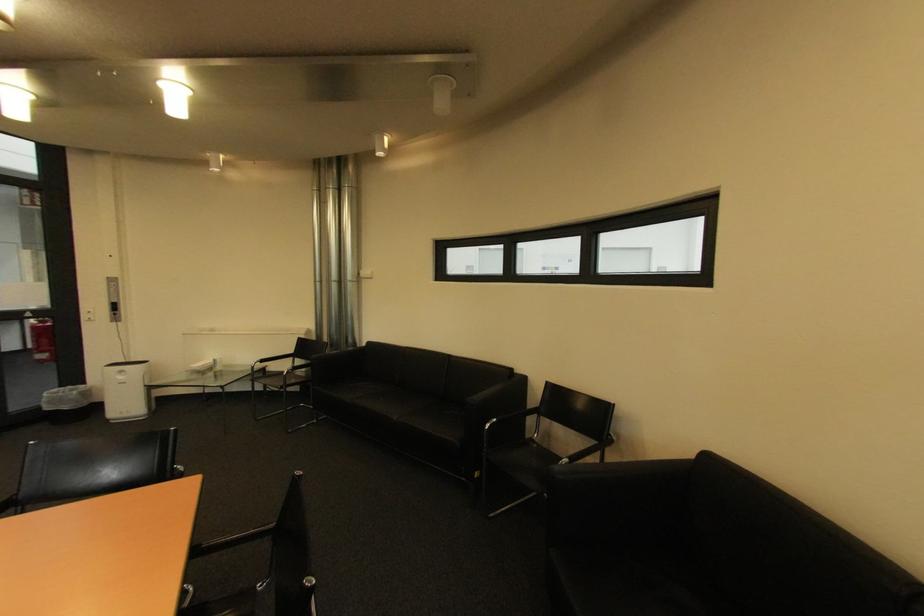
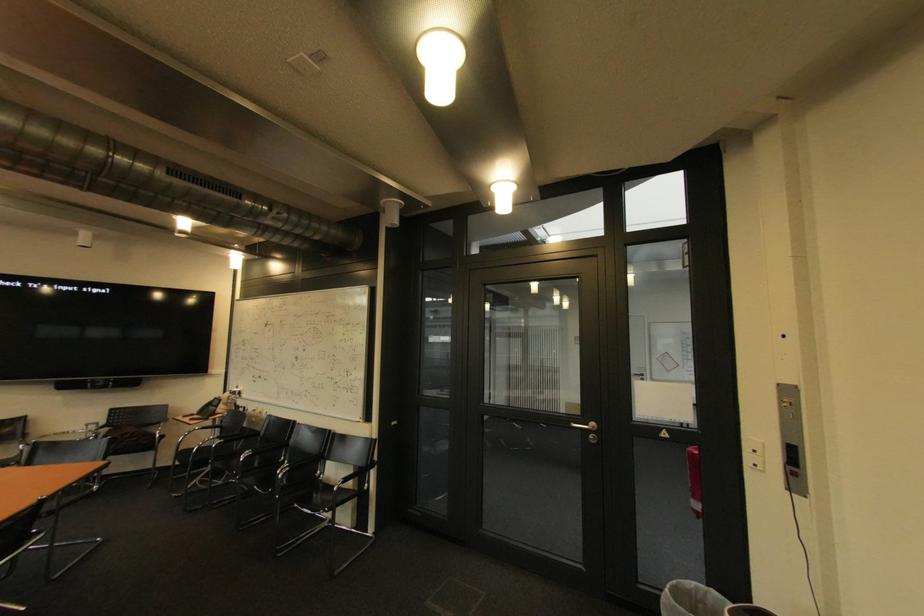
Locate, in the second image, the point that corresponds to pixel 92 318 in the first image.

(757, 459)